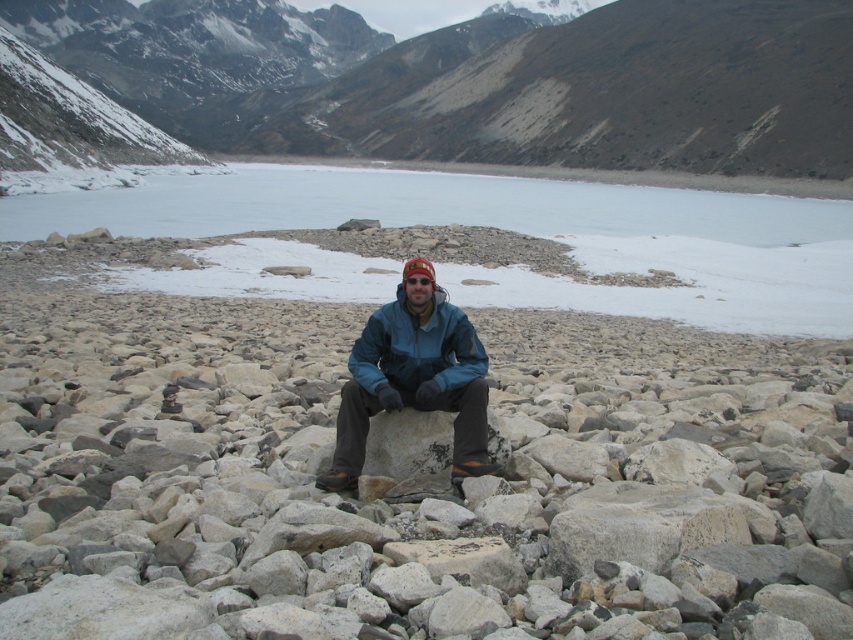
You are planning to take a photo of the brown rocky mountain at upper center and the blue fabric jacket at center. Which object will appear larger in the photo?

The brown rocky mountain at upper center will appear larger in the photo because it has a greater height compared to the blue fabric jacket at center.

You are planning to place a small backpack on the ground next to the blue fabric jacket at center. Based on the scene, where should you place it so that it doesn not block the view of the white ice at upper center?

You should place the small backpack on the left side of the blue fabric jacket at center, as the white ice at upper center is positioned on the right side of the blue fabric jacket at center, so placing the backpack on the left would keep the view of the white ice at upper center unobstructed.